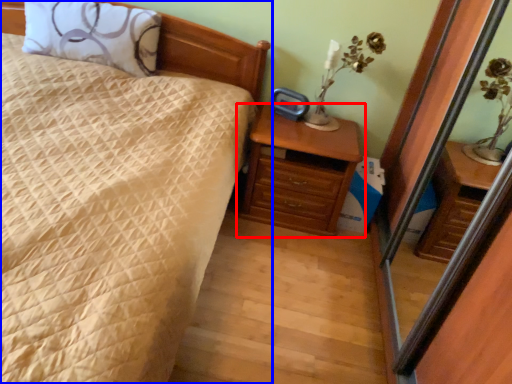
Question: Among these objects, which one is farthest to the camera, chest of drawers (highlighted by a red box) or bed (highlighted by a blue box)?

Choices:
 (A) chest of drawers
 (B) bed

Answer: (A)